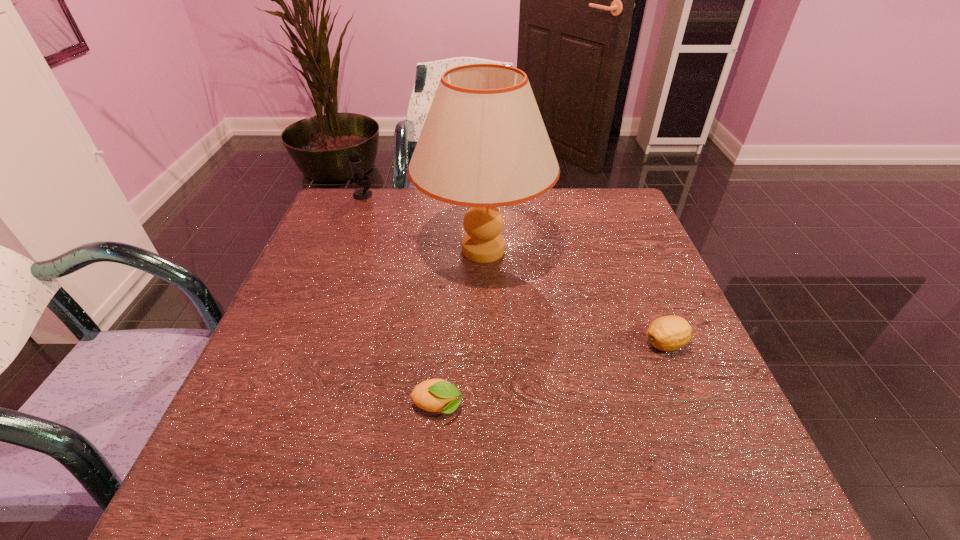
Locate an element on the screen. the third nearest object is located at coordinates (483, 145).

You are a GUI agent. You are given a task and a screenshot of the screen. Output one action in this format:
    pyautogui.click(x=<x>, y=<y>)
    Task: Click on the lampshade
    The image size is (960, 540).
    Given the screenshot: What is the action you would take?
    pyautogui.click(x=483, y=145)

You are a GUI agent. You are given a task and a screenshot of the screen. Output one action in this format:
    pyautogui.click(x=<x>, y=<y>)
    Task: Click on the second tallest object
    
    Given the screenshot: What is the action you would take?
    pyautogui.click(x=356, y=167)

Find the location of a particular element. The height and width of the screenshot is (540, 960). the farthest object is located at coordinates (356, 167).

Where is `the farther lemon`? This screenshot has height=540, width=960. the farther lemon is located at coordinates (667, 333).

Find the location of a particular element. the second nearest object is located at coordinates (667, 333).

This screenshot has height=540, width=960. I want to click on the left lemon, so click(x=434, y=395).

Identify the location of the nearer lemon. (434, 395).

Locate an element on the screen. The image size is (960, 540). free spot located on the right of the lampshade is located at coordinates (614, 250).

Image resolution: width=960 pixels, height=540 pixels. In order to click on blank area located on the front of the leftmost object in this screenshot , I will do `click(344, 246)`.